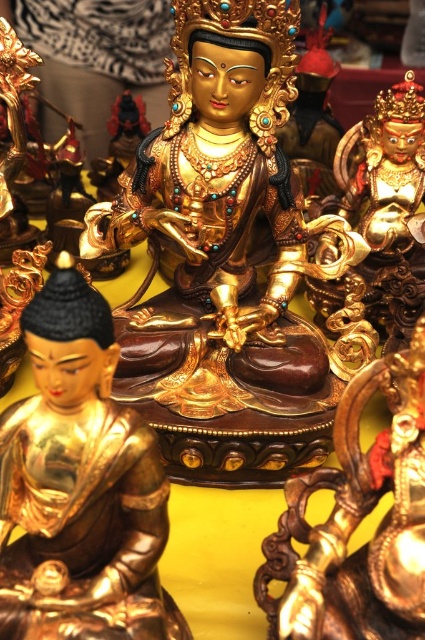
Question: Is gold polished statue at lower left closer to the viewer compared to gold polished statue at center?

Choices:
 (A) yes
 (B) no

Answer: (A)

Question: Which of the following is the farthest from the observer?

Choices:
 (A) gold/gilded statue at center
 (B) gold polished statue at lower left
 (C) gold polished statue at center

Answer: (A)

Question: Is gold polished statue at lower left wider than gold polished statue at center?

Choices:
 (A) yes
 (B) no

Answer: (A)

Question: Which object appears closest to the camera in this image?

Choices:
 (A) gold polished statue at center
 (B) gold polished statue at lower left
 (C) gold/gilded statue at center

Answer: (B)

Question: Estimate the real-world distances between objects in this image. Which object is closer to the gold/gilded statue at center?

Choices:
 (A) gold polished statue at center
 (B) gold polished statue at lower left

Answer: (A)

Question: Is gold polished statue at lower left bigger than gold polished statue at center?

Choices:
 (A) no
 (B) yes

Answer: (B)